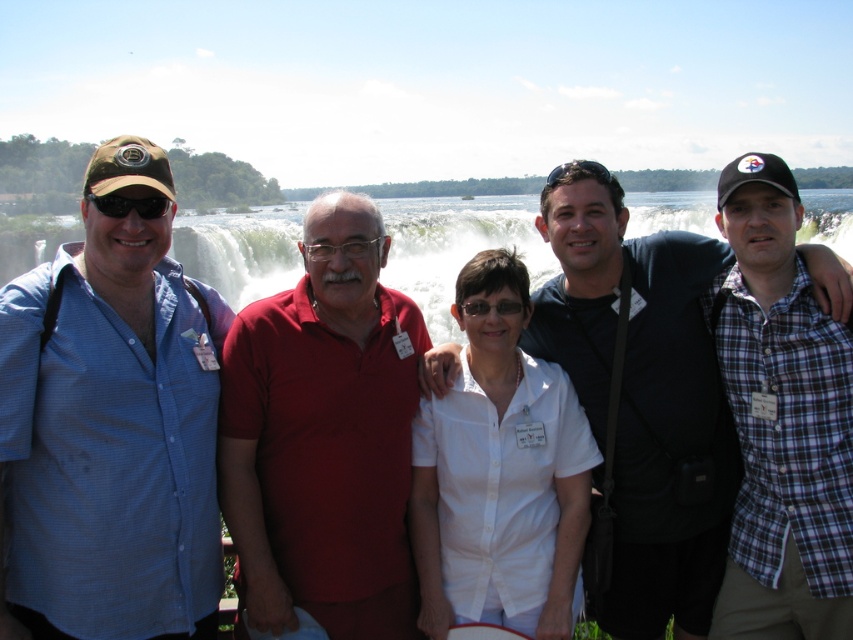
Does blue checkered shirt at left have a lesser height compared to white matte shirt at center?

In fact, blue checkered shirt at left may be taller than white matte shirt at center.

Which of these two, blue checkered shirt at left or white matte shirt at center, stands taller?

blue checkered shirt at left

From the picture: Who is more distant from viewer, (77, 563) or (491, 326)?

The point (491, 326) is behind.

The image size is (853, 640). I want to click on blue checkered shirt at left, so click(112, 422).

Is red matte shirt at center to the left of dark blue shirt at center from the viewer's perspective?

Yes, red matte shirt at center is to the left of dark blue shirt at center.

Looking at this image, does red matte shirt at center have a larger size compared to dark blue shirt at center?

No.

Does point (287, 592) come closer to viewer compared to point (682, 419)?

Yes, point (287, 592) is in front of point (682, 419).

Identify the location of red matte shirt at center. (323, 435).

Is point (368, 353) in front of point (798, 496)?

No, (368, 353) is further to viewer.

Is red matte shirt at center positioned behind plaid cotton shirt at right?

That is True.

Is point (395, 300) closer to viewer compared to point (741, 548)?

No, it is not.

Where is `red matte shirt at center`? red matte shirt at center is located at coordinates (323, 435).